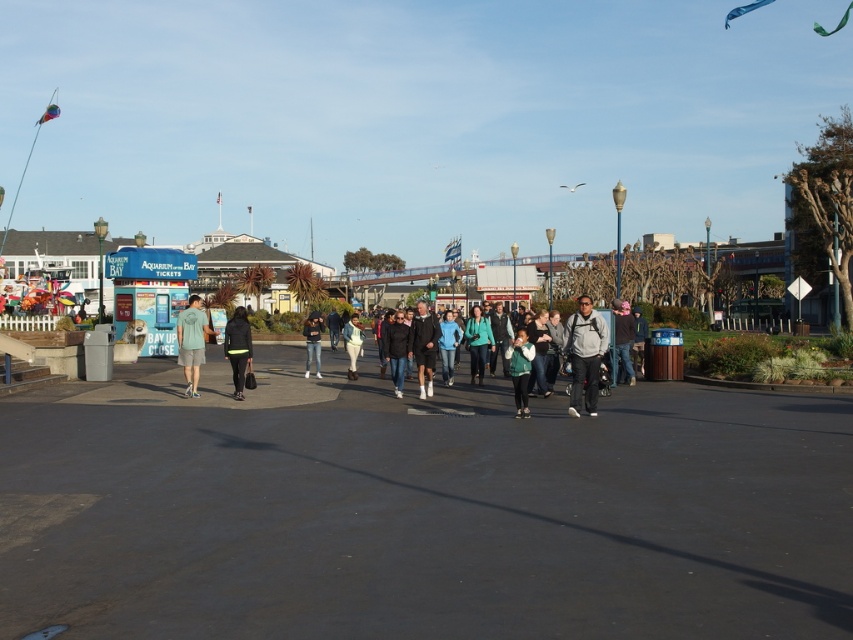
Is neon yellow fabric pants at center thinner than green fleece jacket at center?

Incorrect, neon yellow fabric pants at center's width is not less than green fleece jacket at center's.

Which of these two, neon yellow fabric pants at center or green fleece jacket at center, stands shorter?

green fleece jacket at center

Where is `neon yellow fabric pants at center`? neon yellow fabric pants at center is located at coordinates (236, 348).

The height and width of the screenshot is (640, 853). I want to click on neon yellow fabric pants at center, so click(236, 348).

Can you confirm if matte green shirt at center is positioned below light blue denim jacket at center?

Incorrect, matte green shirt at center is not positioned below light blue denim jacket at center.

Can you confirm if matte green shirt at center is positioned to the right of light blue denim jacket at center?

Incorrect, matte green shirt at center is not on the right side of light blue denim jacket at center.

Which is in front, point (199, 362) or point (357, 330)?

Point (199, 362) is more forward.

Identify the location of matte green shirt at center. (192, 342).

Is the position of black leather jacket at center more distant than that of dark gray hoodie at center?

No, black leather jacket at center is closer to the viewer.

Measure the distance between black leather jacket at center and camera.

55.88 feet

Between point (399, 396) and point (624, 340), which one is positioned behind?

The point (624, 340) is more distant.

Find the location of a particular element. Image resolution: width=853 pixels, height=640 pixels. black leather jacket at center is located at coordinates (396, 349).